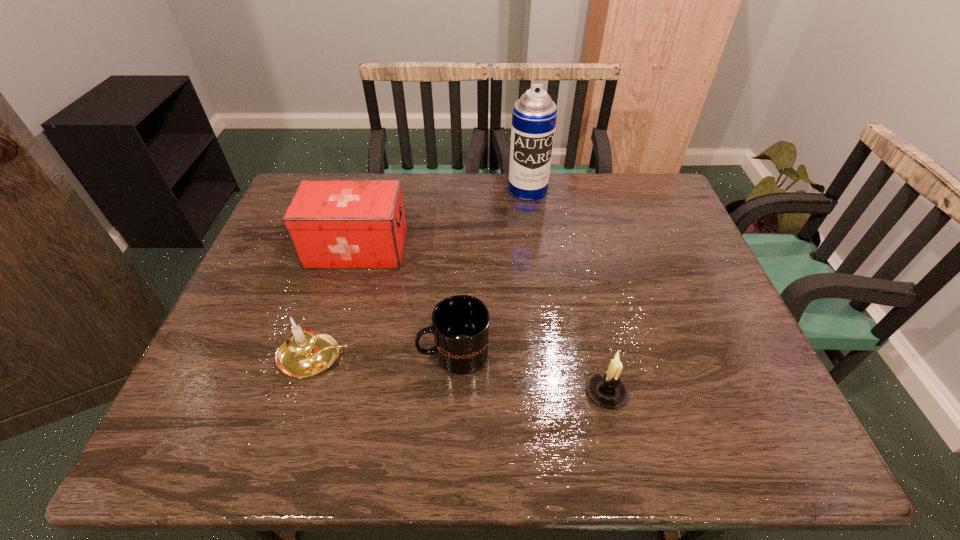
Where is `free spot located 0.190m on the left of the rightmost object`? This screenshot has width=960, height=540. free spot located 0.190m on the left of the rightmost object is located at coordinates (496, 392).

Image resolution: width=960 pixels, height=540 pixels. Identify the location of vacant space situated with the handle on the side of the third object from left to right. (326, 353).

Identify the location of free spot located 0.210m with the handle on the side of the third object from left to right. point(326,353).

This screenshot has height=540, width=960. In order to click on free space located with the handle on the side of the third object from left to right in this screenshot , I will do `click(331, 353)`.

Where is `object at the far edge`? object at the far edge is located at coordinates (534, 115).

In order to click on the first-aid kit that is at the left edge in this screenshot , I will do `click(333, 224)`.

Locate an element on the screen. The width and height of the screenshot is (960, 540). candle holder that is at the left edge is located at coordinates (305, 353).

I want to click on free space at the far edge, so click(x=584, y=188).

This screenshot has height=540, width=960. In the image, there is a desktop. Identify the location of blank space at the left edge. (255, 406).

Where is `vacant space at the right edge of the desktop`? vacant space at the right edge of the desktop is located at coordinates (704, 361).